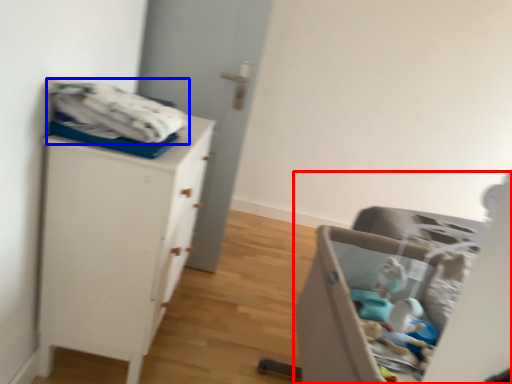
Question: Which object appears closest to the camera in this image, furniture (highlighted by a red box) or baby clothe (highlighted by a blue box)?

Choices:
 (A) furniture
 (B) baby clothe

Answer: (A)